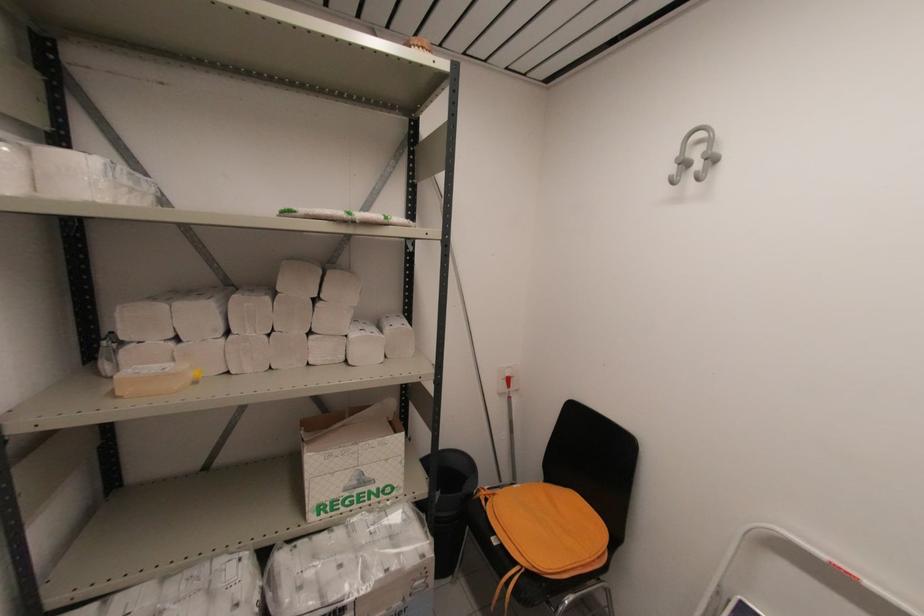
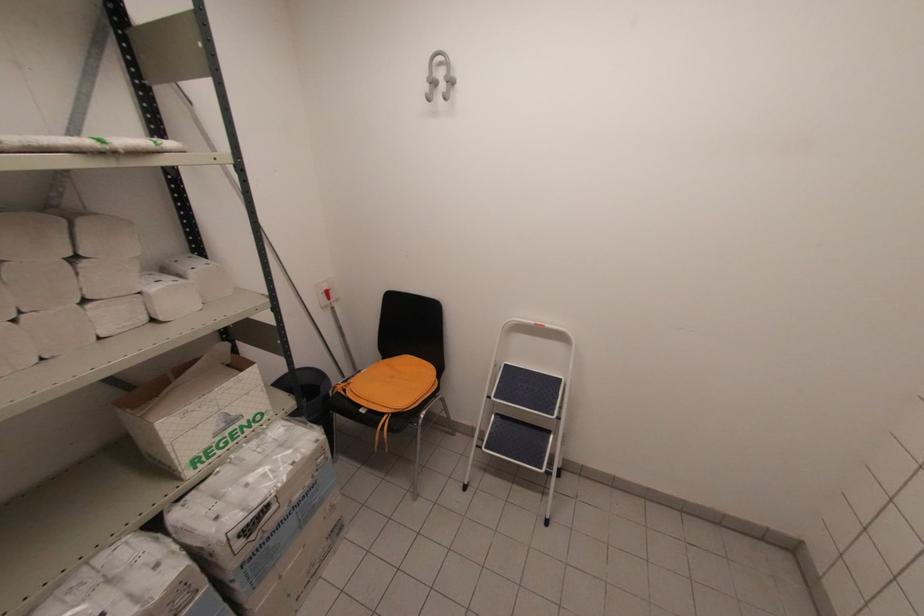
Find the pixel in the second image that matches (x=681, y=164) in the first image.

(431, 84)